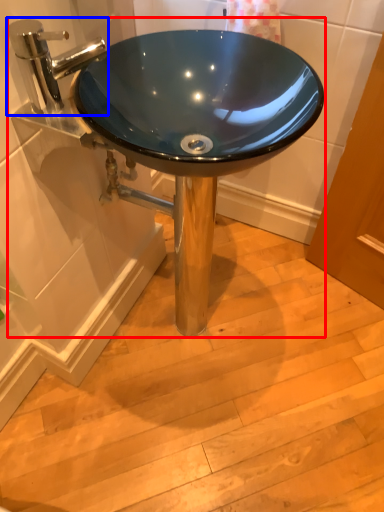
Question: Which of the following is the farthest to the observer, sink (highlighted by a red box) or tap (highlighted by a blue box)?

Choices:
 (A) sink
 (B) tap

Answer: (A)